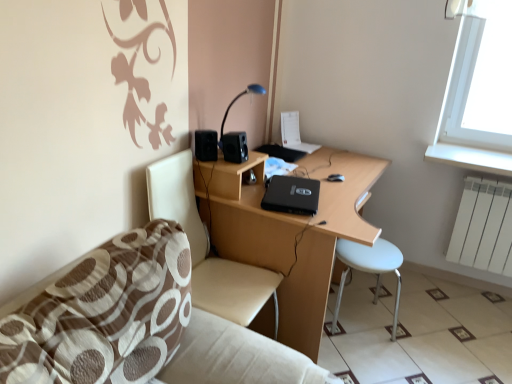
This screenshot has width=512, height=384. What do you see at coordinates (295, 236) in the screenshot?
I see `black matte desk at center` at bounding box center [295, 236].

This screenshot has width=512, height=384. What are the coordinates of `black matte desk at center` in the screenshot? It's located at (295, 236).

What is the approximate width of beige fabric chair at left?

The width of beige fabric chair at left is 20.36 inches.

The width and height of the screenshot is (512, 384). I want to click on white plastic stool at lower right, so click(x=369, y=269).

The height and width of the screenshot is (384, 512). I want to click on brown fabric couch at lower left, so click(137, 324).

How much space does black plastic speaker at upper center, the 2th speaker positioned from the left, occupy horizontally?

It is 4.87 inches.

You are a GUI agent. You are given a task and a screenshot of the screen. Output one action in this format:
    pyautogui.click(x=<x>, y=<y>)
    Task: Click on the black matte speaker at upper left, arranged as the first speaker when viewed from the left
    
    Given the screenshot: What is the action you would take?
    pyautogui.click(x=206, y=145)

Measure the distance between white glossy tile at lower right and camera.

The distance of white glossy tile at lower right from camera is 6.56 feet.

Locate an element on the screen. The height and width of the screenshot is (384, 512). black matte desk at center is located at coordinates (295, 236).

From a real-world perspective, is beige fabric chair at left beneath brown fabric couch at lower left?

Yes, from a real-world perspective, beige fabric chair at left is under brown fabric couch at lower left.

How many degrees apart are the facing directions of beige fabric chair at left and brown fabric couch at lower left?

The angle between the facing direction of beige fabric chair at left and the facing direction of brown fabric couch at lower left is 0.87 degrees.

Between beige fabric chair at left and brown fabric couch at lower left, which one appears on the right side from the viewer's perspective?

beige fabric chair at left is more to the right.

Looking at their sizes, would you say beige fabric chair at left is wider or thinner than brown fabric couch at lower left?

beige fabric chair at left is wider than brown fabric couch at lower left.

Considering the sizes of objects black matte laptop at center and blue glossy table lamp at upper center in the image provided, who is thinner, black matte laptop at center or blue glossy table lamp at upper center?

With smaller width is blue glossy table lamp at upper center.

How much distance is there between black matte laptop at center and blue glossy table lamp at upper center?

black matte laptop at center and blue glossy table lamp at upper center are 19.23 inches apart.

Is black matte laptop at center further to camera compared to blue glossy table lamp at upper center?

No, it is in front of blue glossy table lamp at upper center.

From the image's perspective, between black matte laptop at center and blue glossy table lamp at upper center, which one is located above?

blue glossy table lamp at upper center.

From a real-world perspective, is white glossy tile at lower right below black matte laptop at center?

Correct, in the physical world, white glossy tile at lower right is lower than black matte laptop at center.

Who is shorter, white glossy tile at lower right or black matte laptop at center?

black matte laptop at center is shorter.

Is white glossy tile at lower right positioned in front of black matte laptop at center?

Yes.

Is white glossy tile at lower right oriented towards black matte laptop at center?

No, white glossy tile at lower right is not oriented towards black matte laptop at center.

Considering the sizes of objects black matte laptop at center and black matte desk at center in the image provided, who is shorter, black matte laptop at center or black matte desk at center?

black matte laptop at center.

From a real-world perspective, is black matte laptop at center positioned above or below black matte desk at center?

From a real-world perspective, black matte laptop at center is physically above black matte desk at center.

Visually, is black matte laptop at center positioned to the left or to the right of black matte desk at center?

Clearly, black matte laptop at center is on the left of black matte desk at center in the image.

You are a GUI agent. You are given a task and a screenshot of the screen. Output one action in this format:
    pyautogui.click(x=<x>, y=<y>)
    Task: Click on the laptop behind the black matte desk at center
    The image size is (512, 384).
    Given the screenshot: What is the action you would take?
    pyautogui.click(x=291, y=195)

Looking at the image, does white plastic stool at lower right seem bigger or smaller compared to black matte desk at center?

Clearly, white plastic stool at lower right is smaller in size than black matte desk at center.

Considering the relative sizes of white plastic stool at lower right and black matte desk at center in the image provided, is white plastic stool at lower right taller than black matte desk at center?

In fact, white plastic stool at lower right may be shorter than black matte desk at center.

Is white plastic stool at lower right next to black matte desk at center and touching it?

No, white plastic stool at lower right is not touching black matte desk at center.

Based on the photo, from a real-world perspective, is white plastic stool at lower right positioned over black matte desk at center based on gravity?

No, from a real-world perspective, white plastic stool at lower right is not above black matte desk at center.

Which of these two, black plastic speaker at upper center, acting as the 1th speaker starting from the right, or white glossy tile at lower right, is wider?

white glossy tile at lower right.

Considering the relative positions of black plastic speaker at upper center, the 2th speaker positioned from the left, and white glossy tile at lower right in the image provided, is black plastic speaker at upper center, the 2th speaker positioned from the left, to the left of white glossy tile at lower right from the viewer's perspective?

Yes.

Which is behind, black plastic speaker at upper center, acting as the 1th speaker starting from the right, or white glossy tile at lower right?

black plastic speaker at upper center, acting as the 1th speaker starting from the right, is further from the camera.

From the image's perspective, who appears lower, black plastic speaker at upper center, the 2th speaker positioned from the left, or white glossy tile at lower right?

white glossy tile at lower right is shown below in the image.

How far apart are beige fabric chair at left and blue glossy table lamp at upper center?

beige fabric chair at left and blue glossy table lamp at upper center are 19.69 inches apart.

Are beige fabric chair at left and blue glossy table lamp at upper center making contact?

beige fabric chair at left and blue glossy table lamp at upper center are clearly separated.

Looking at their sizes, would you say beige fabric chair at left is wider or thinner than blue glossy table lamp at upper center?

A: In the image, beige fabric chair at left appears to be wider than blue glossy table lamp at upper center.

Which point is more forward, (236,306) or (229,106)?

The point (236,306) is closer to the camera.

The width and height of the screenshot is (512, 384). In order to click on chair behind the brown fabric couch at lower left in this screenshot , I will do `click(208, 248)`.

Where is `laptop located below the blue glossy table lamp at upper center (from the image's perspective)`? laptop located below the blue glossy table lamp at upper center (from the image's perspective) is located at coordinates tap(291, 195).

When comparing their distances from brown fabric couch at lower left, does black matte laptop at center or black matte speaker at upper left, the second speaker positioned from the right, seem further?

black matte speaker at upper left, the second speaker positioned from the right.

In the scene shown: From the image, which object appears to be farther from white glossy tile at lower right, blue glossy table lamp at upper center or black plastic speaker at upper center, the 2th speaker positioned from the left?

Based on the image, blue glossy table lamp at upper center appears to be further to white glossy tile at lower right.

Based on their spatial positions, is beige fabric chair at left or black plastic speaker at upper center, the 2th speaker positioned from the left, further from white glossy tile at lower right?

black plastic speaker at upper center, the 2th speaker positioned from the left, is further to white glossy tile at lower right.

Considering their positions, is black matte desk at center positioned closer to brown fabric couch at lower left than white plastic stool at lower right?

Among the two, black matte desk at center is located nearer to brown fabric couch at lower left.

Considering their positions, is white plastic stool at lower right positioned closer to blue glossy table lamp at upper center than beige fabric chair at left?

The object closer to blue glossy table lamp at upper center is beige fabric chair at left.

Based on their spatial positions, is brown fabric couch at lower left or blue glossy table lamp at upper center closer to black matte desk at center?

Based on the image, blue glossy table lamp at upper center appears to be nearer to black matte desk at center.

Which object lies further to the anchor point white matte radiator at right, black matte laptop at center or beige fabric chair at left?

Among the two, beige fabric chair at left is located further to white matte radiator at right.

Estimate the real-world distances between objects in this image. Which object is further from beige fabric chair at left, black plastic speaker at upper center, acting as the 1th speaker starting from the right, or black matte speaker at upper left, the second speaker positioned from the right?

black plastic speaker at upper center, acting as the 1th speaker starting from the right.

The height and width of the screenshot is (384, 512). I want to click on tile between beige fabric chair at left and white matte radiator at right in the horizontal direction, so click(419, 333).

At what (x,y) coordinates should I click in order to perform the action: click on chair located between brown fabric couch at lower left and black matte desk at center in the depth direction. Please return your answer as a coordinate pair (x, y). This screenshot has width=512, height=384. Looking at the image, I should click on (208, 248).

Where is `tile between black matte speaker at upper left, the second speaker positioned from the right, and white matte radiator at right`? This screenshot has width=512, height=384. tile between black matte speaker at upper left, the second speaker positioned from the right, and white matte radiator at right is located at coordinates (419, 333).

Identify the location of laptop located between beige fabric chair at left and white matte radiator at right in the left-right direction. (291, 195).